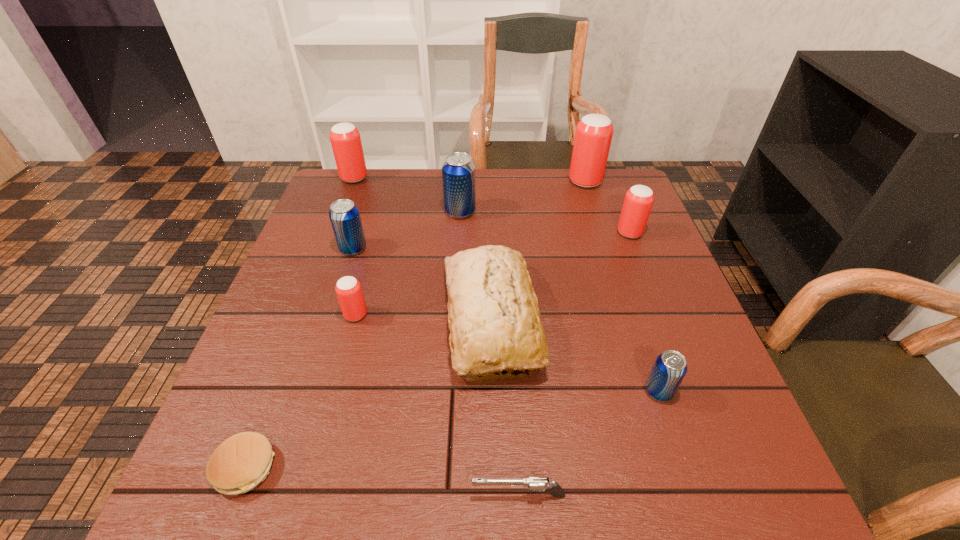
Locate an element on the screen. This screenshot has width=960, height=540. vacant space situated 0.330m on the right of the leftmost blue beer can is located at coordinates 497,249.

Where is `vacant space situated 0.180m on the left of the bread`? This screenshot has height=540, width=960. vacant space situated 0.180m on the left of the bread is located at coordinates (358, 321).

Find the location of a particular element. vacant space located 0.130m on the back of the rightmost blue beer can is located at coordinates point(637,327).

You are a GUI agent. You are given a task and a screenshot of the screen. Output one action in this format:
    pyautogui.click(x=<x>, y=<y>)
    Task: Click on the vacant space located on the right of the nearest red beer can
    This screenshot has height=540, width=960.
    Given the screenshot: What is the action you would take?
    pyautogui.click(x=516, y=315)

This screenshot has width=960, height=540. What are the coordinates of `vacant space located on the front-facing side of the second shortest object` in the screenshot? It's located at (427, 495).

You are a GUI agent. You are given a task and a screenshot of the screen. Output one action in this format:
    pyautogui.click(x=<x>, y=<y>)
    Task: Click on the free region located on the front-facing side of the second shortest object
    The width and height of the screenshot is (960, 540).
    Given the screenshot: What is the action you would take?
    pyautogui.click(x=268, y=495)

You are a GUI agent. You are given a task and a screenshot of the screen. Output one action in this format:
    pyautogui.click(x=<x>, y=<y>)
    Task: Click on the free region located on the front-facing side of the second shortest object
    The image size is (960, 540).
    Given the screenshot: What is the action you would take?
    pyautogui.click(x=338, y=495)

Image resolution: width=960 pixels, height=540 pixels. Find the location of `vacant region located 0.120m on the right of the shortest object`. vacant region located 0.120m on the right of the shortest object is located at coordinates (348, 467).

Where is `pistol that is at the near edge`? pistol that is at the near edge is located at coordinates (539, 484).

This screenshot has width=960, height=540. Find the location of `patty positioned at the near edge`. patty positioned at the near edge is located at coordinates (241, 462).